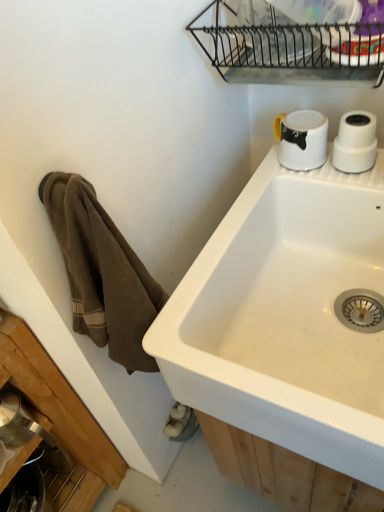
Question: Considering the relative positions of white ceramic sink at upper right and metallic wire rack at upper center in the image provided, is white ceramic sink at upper right in front of metallic wire rack at upper center?

Choices:
 (A) yes
 (B) no

Answer: (A)

Question: Can you confirm if white ceramic sink at upper right is taller than metallic wire rack at upper center?

Choices:
 (A) no
 (B) yes

Answer: (B)

Question: Does white ceramic sink at upper right have a smaller size compared to metallic wire rack at upper center?

Choices:
 (A) yes
 (B) no

Answer: (B)

Question: From a real-world perspective, does white ceramic sink at upper right stand above metallic wire rack at upper center?

Choices:
 (A) yes
 (B) no

Answer: (B)

Question: Would you say white ceramic sink at upper right is outside metallic wire rack at upper center?

Choices:
 (A) no
 (B) yes

Answer: (B)

Question: Is white ceramic sink at upper right thinner than metallic wire rack at upper center?

Choices:
 (A) no
 (B) yes

Answer: (A)

Question: Is white ceramic sink at upper right positioned before white glossy mug at upper right?

Choices:
 (A) no
 (B) yes

Answer: (B)

Question: Would you say white glossy mug at upper right is part of white ceramic sink at upper right's contents?

Choices:
 (A) no
 (B) yes

Answer: (A)

Question: Is white ceramic sink at upper right aimed at white glossy mug at upper right?

Choices:
 (A) yes
 (B) no

Answer: (B)

Question: Can you confirm if white ceramic sink at upper right is taller than white glossy mug at upper right?

Choices:
 (A) yes
 (B) no

Answer: (A)

Question: Is white ceramic sink at upper right touching white glossy mug at upper right?

Choices:
 (A) no
 (B) yes

Answer: (A)

Question: Can you confirm if white ceramic sink at upper right is shorter than white glossy mug at upper right?

Choices:
 (A) no
 (B) yes

Answer: (A)

Question: Considering the relative sizes of metallic wire rack at upper center and white ceramic sink at upper right in the image provided, is metallic wire rack at upper center bigger than white ceramic sink at upper right?

Choices:
 (A) no
 (B) yes

Answer: (A)